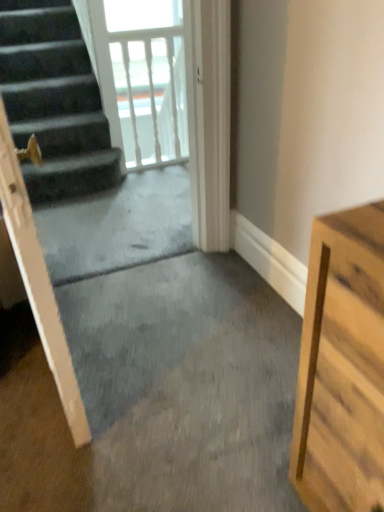
Where is `white textured glass door at upper center`? white textured glass door at upper center is located at coordinates (142, 77).

The width and height of the screenshot is (384, 512). What do you see at coordinates (142, 77) in the screenshot? I see `white textured glass door at upper center` at bounding box center [142, 77].

Find the location of a particular element. Image resolution: width=384 pixels, height=512 pixels. white textured glass door at upper center is located at coordinates (142, 77).